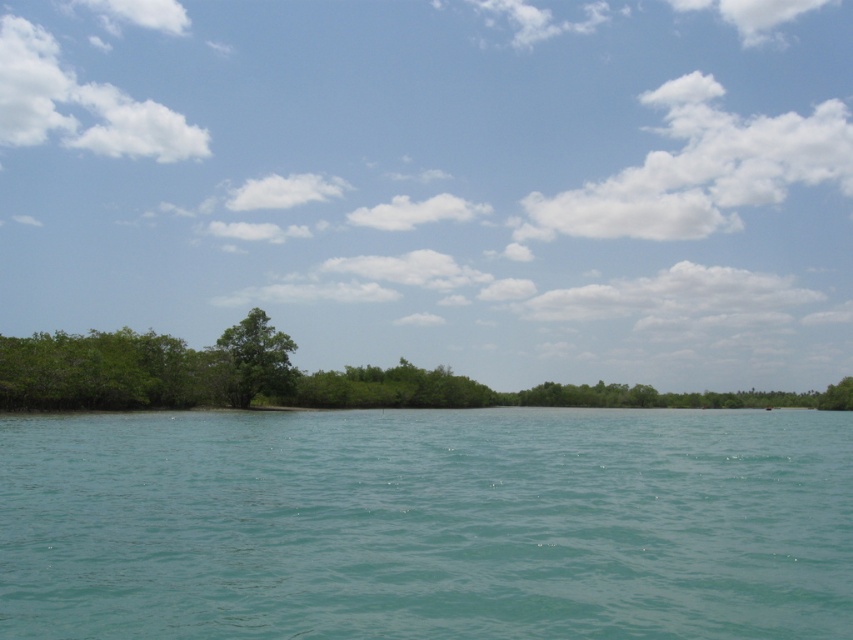
Question: Which point is closer to the camera?

Choices:
 (A) (241, 392)
 (B) (474, 509)

Answer: (B)

Question: Can you confirm if teal water at center is bigger than green leafy tree at center?

Choices:
 (A) yes
 (B) no

Answer: (A)

Question: Is teal water at center smaller than green leafy tree at center?

Choices:
 (A) no
 (B) yes

Answer: (A)

Question: Which of the following is the farthest from the observer?

Choices:
 (A) (788, 572)
 (B) (267, 330)

Answer: (B)

Question: Does teal water at center appear under green leafy tree at center?

Choices:
 (A) yes
 (B) no

Answer: (A)